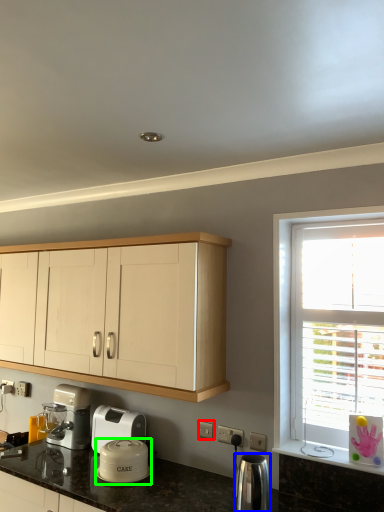
Question: Which is farther away from electric outlet (highlighted by a red box)? kitchen appliance (highlighted by a blue box) or kitchen appliance (highlighted by a green box)?

Choices:
 (A) kitchen appliance
 (B) kitchen appliance

Answer: (B)